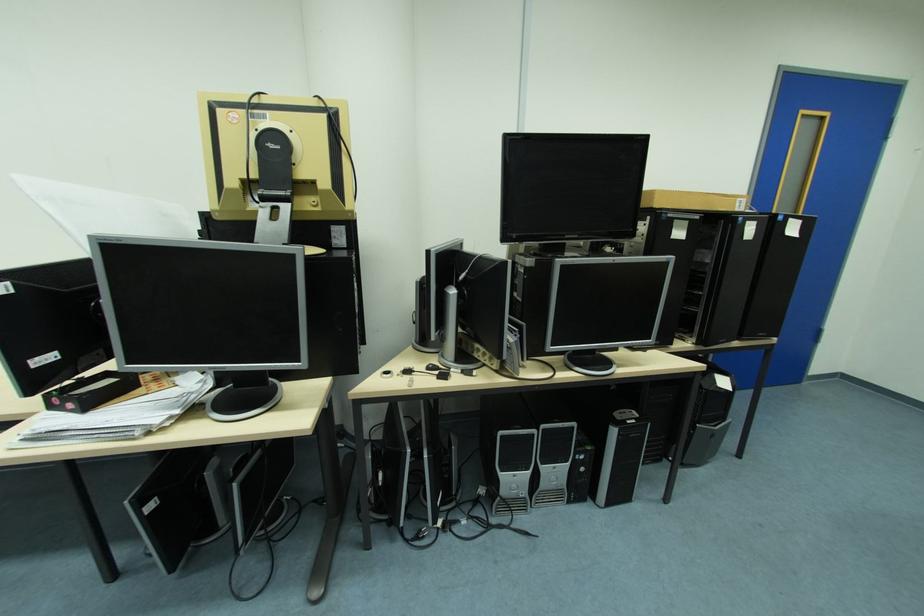
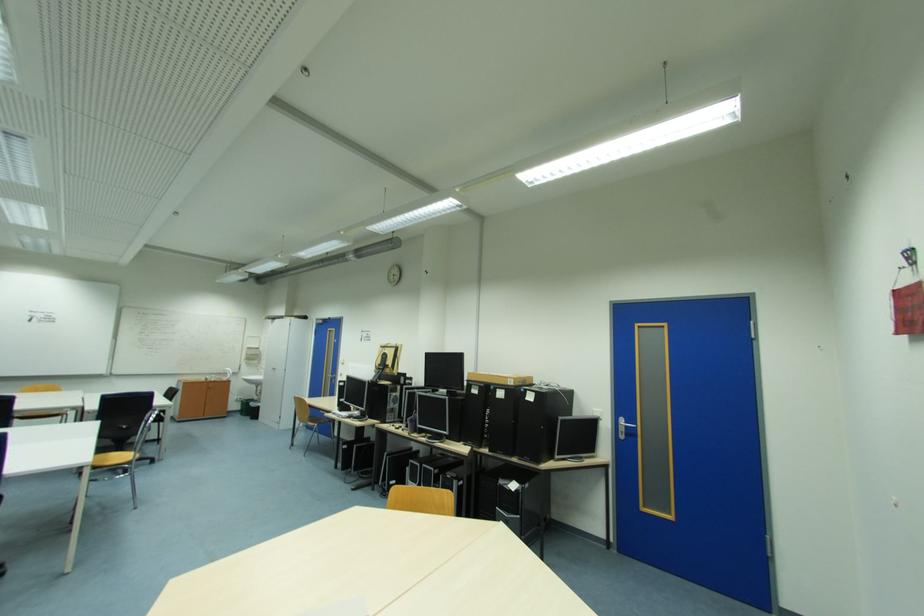
Find the pixel in the second image that matches (746,206) in the first image.

(517, 382)